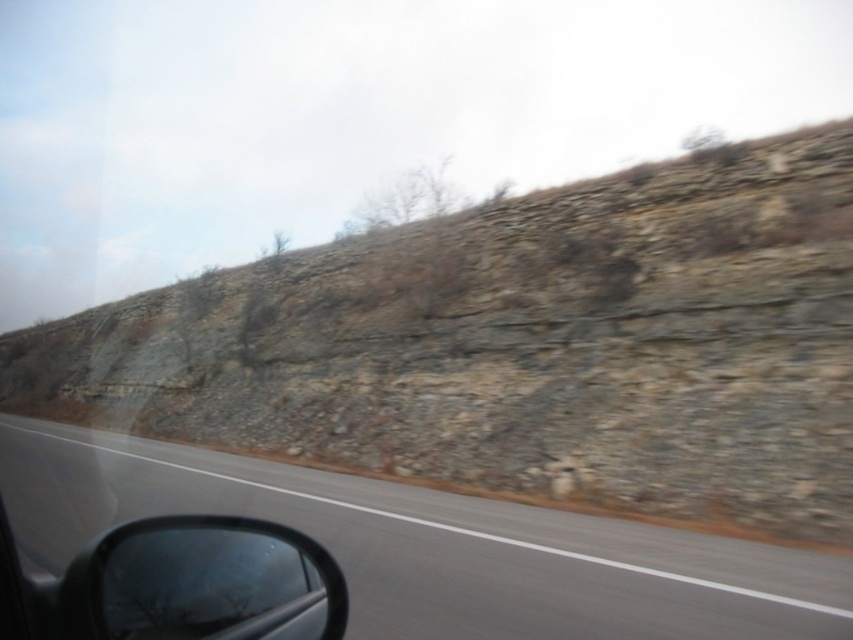
You are a passenger in the car and looking out the window. You see the rocky terrain at upper right and the gray asphalt road at lower left. Which object is located to the left of the other?

The rocky terrain at upper right is positioned on the left side of gray asphalt road at lower left.

You are sitting in the car and looking out the side window. You see two points marked on the road ahead. The first point is at coordinates point (618, 616) and the second point is at point (187, 536). Which point is closer to your eyes?

Point (187, 536) is closer to your eyes because it is less further to the camera than point (618, 616).

You are driving a car and need to park in a spot that is exactly 10 meters away from your current position. Using the point marked at coordinates point (421, 492) as a reference, can you determine if this point is within the required distance for parking?

The point (421, 492) is 10.44 meters away from the camera, which is slightly beyond the 10 meters required for parking. Therefore, it is not within the required distance.